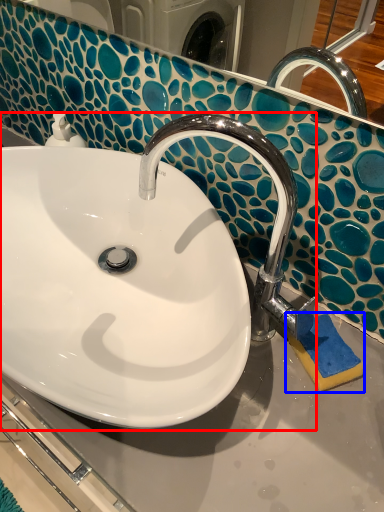
Question: Which point is closer to the camera, sink (highlighted by a red box) or soap (highlighted by a blue box)?

Choices:
 (A) sink
 (B) soap

Answer: (A)